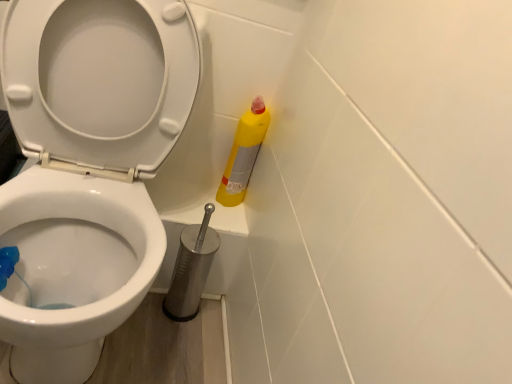
Question: From the image's perspective, is metallic silver toilet brush at lower center located beneath yellow matte bottle at right?

Choices:
 (A) no
 (B) yes

Answer: (B)

Question: Is metallic silver toilet brush at lower center thinner than yellow matte bottle at right?

Choices:
 (A) no
 (B) yes

Answer: (A)

Question: From a real-world perspective, is metallic silver toilet brush at lower center under yellow matte bottle at right?

Choices:
 (A) yes
 (B) no

Answer: (A)

Question: Considering the relative sizes of metallic silver toilet brush at lower center and yellow matte bottle at right in the image provided, is metallic silver toilet brush at lower center shorter than yellow matte bottle at right?

Choices:
 (A) yes
 (B) no

Answer: (B)

Question: Is metallic silver toilet brush at lower center at the left side of yellow matte bottle at right?

Choices:
 (A) yes
 (B) no

Answer: (A)

Question: Is metallic silver toilet brush at lower center in front of or behind white glossy toilet at center in the image?

Choices:
 (A) front
 (B) behind

Answer: (B)

Question: Would you say metallic silver toilet brush at lower center is inside or outside white glossy toilet at center?

Choices:
 (A) inside
 (B) outside

Answer: (B)

Question: From a real-world perspective, is metallic silver toilet brush at lower center physically located above or below white glossy toilet at center?

Choices:
 (A) below
 (B) above

Answer: (A)

Question: Is point (203, 230) closer or farther from the camera than point (169, 4)?

Choices:
 (A) closer
 (B) farther

Answer: (B)

Question: From a real-world perspective, is metallic silver toilet brush at lower center positioned above or below yellow matte bottle at right?

Choices:
 (A) above
 (B) below

Answer: (B)

Question: Is metallic silver toilet brush at lower center to the left or to the right of yellow matte bottle at right in the image?

Choices:
 (A) right
 (B) left

Answer: (B)

Question: Considering their positions, is metallic silver toilet brush at lower center located in front of or behind yellow matte bottle at right?

Choices:
 (A) front
 (B) behind

Answer: (A)

Question: Considering the positions of metallic silver toilet brush at lower center and yellow matte bottle at right in the image, is metallic silver toilet brush at lower center taller or shorter than yellow matte bottle at right?

Choices:
 (A) tall
 (B) short

Answer: (A)

Question: Considering the relative positions of yellow matte bottle at right and white glossy toilet at center in the image provided, is yellow matte bottle at right to the left or to the right of white glossy toilet at center?

Choices:
 (A) left
 (B) right

Answer: (B)

Question: Is yellow matte bottle at right in front of or behind white glossy toilet at center in the image?

Choices:
 (A) front
 (B) behind

Answer: (B)